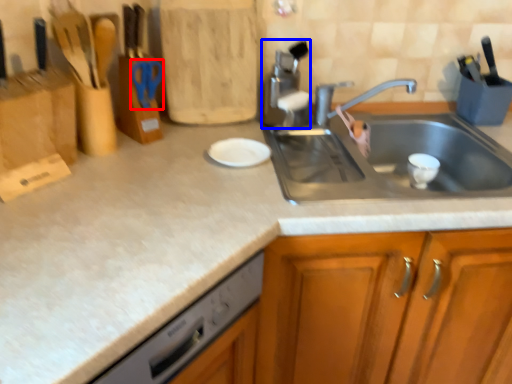
Question: Which point is closer to the camera, scissors (highlighted by a red box) or appliance (highlighted by a blue box)?

Choices:
 (A) scissors
 (B) appliance

Answer: (A)